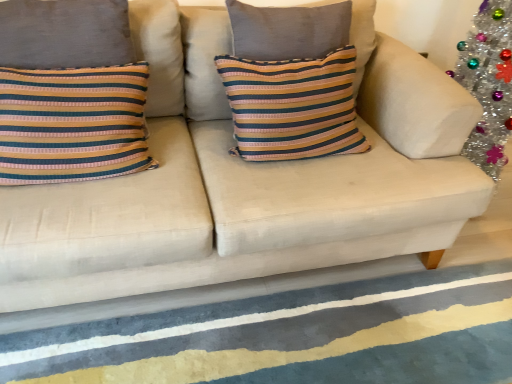
Describe the element at coordinates (294, 337) in the screenshot. I see `textured blue rug at lower center` at that location.

Locate an element on the screen. textured blue rug at lower center is located at coordinates (294, 337).

What is the approximate height of textured blue rug at lower center?

textured blue rug at lower center is 1.95 inches tall.

What is the approximate width of striped fabric pillow at center?

9.18 inches.

Describe the element at coordinates (293, 106) in the screenshot. The width and height of the screenshot is (512, 384). I see `striped fabric pillow at center` at that location.

What is the approximate height of striped fabric pillow at center?

It is 19.53 inches.

Locate an element on the screen. Image resolution: width=512 pixels, height=384 pixels. striped fabric pillow at center is located at coordinates (293, 106).

Image resolution: width=512 pixels, height=384 pixels. What are the coordinates of `textured blue rug at lower center` in the screenshot? It's located at coord(294,337).

Consider the image. Considering the relative positions of striped fabric pillow at center and textured blue rug at lower center in the image provided, is striped fabric pillow at center to the right of textured blue rug at lower center from the viewer's perspective?

No.

Does striped fabric pillow at center come behind textured blue rug at lower center?

Yes, striped fabric pillow at center is further from the viewer.

Between point (316, 146) and point (486, 297), which one is positioned in front?

The point (316, 146) is closer.

Consider the image. From the image's perspective, which one is positioned higher, striped fabric pillow at center or textured blue rug at lower center?

striped fabric pillow at center appears higher in the image.

From a real-world perspective, is striped fabric pillow at center under textured blue rug at lower center?

No, from a real-world perspective, striped fabric pillow at center is not beneath textured blue rug at lower center.

Can you confirm if striped fabric pillow at center is thinner than textured blue rug at lower center?

Indeed, striped fabric pillow at center has a lesser width compared to textured blue rug at lower center.

Does striped fabric pillow at center have a lesser height compared to textured blue rug at lower center?

No, striped fabric pillow at center is not shorter than textured blue rug at lower center.

Looking at the image, does striped fabric pillow at center seem bigger or smaller compared to textured blue rug at lower center?

In the image, striped fabric pillow at center appears to be larger than textured blue rug at lower center.

Is striped fabric pillow at center not inside textured blue rug at lower center?

striped fabric pillow at center is positioned outside textured blue rug at lower center.

Is striped fabric pillow at center beside textured blue rug at lower center?

No, striped fabric pillow at center is not with textured blue rug at lower center.

Is striped fabric pillow at center facing away from textured blue rug at lower center?

striped fabric pillow at center does not have its back to textured blue rug at lower center.

How many degrees apart are the facing directions of striped fabric pillow at center and textured blue rug at lower center?

90 degrees.

The width and height of the screenshot is (512, 384). Identify the location of stripe in front of the striped fabric pillow at center. (294, 337).

Between textured blue rug at lower center and striped fabric pillow at center, which one appears on the right side from the viewer's perspective?

Positioned to the right is textured blue rug at lower center.

Is textured blue rug at lower center positioned before striped fabric pillow at center?

Yes, it is.

Is point (504, 264) closer to camera compared to point (328, 114)?

No, it is behind (328, 114).

From the image's perspective, does textured blue rug at lower center appear higher than striped fabric pillow at center?

Incorrect, from the image's perspective, textured blue rug at lower center is lower than striped fabric pillow at center.

From a real-world perspective, which is physically above, textured blue rug at lower center or striped fabric pillow at center?

From a 3D spatial view, striped fabric pillow at center is above.

Which object is wider, textured blue rug at lower center or striped fabric pillow at center?

textured blue rug at lower center.

Considering the sizes of objects textured blue rug at lower center and striped fabric pillow at center in the image provided, who is taller, textured blue rug at lower center or striped fabric pillow at center?

striped fabric pillow at center.

Does textured blue rug at lower center have a larger size compared to striped fabric pillow at center?

No.

Consider the image. Do you think textured blue rug at lower center is within striped fabric pillow at center, or outside of it?

textured blue rug at lower center is outside striped fabric pillow at center.

Is textured blue rug at lower center in contact with striped fabric pillow at center?

No, textured blue rug at lower center is not making contact with striped fabric pillow at center.

Could you tell me if textured blue rug at lower center is facing striped fabric pillow at center?

No, textured blue rug at lower center is not facing towards striped fabric pillow at center.

How different are the orientations of textured blue rug at lower center and striped fabric pillow at center in degrees?

There is a 90-degree angle between the facing directions of textured blue rug at lower center and striped fabric pillow at center.

In the image, there is a textured blue rug at lower center. Identify the location of pillow above it (from the image's perspective). Image resolution: width=512 pixels, height=384 pixels. (293, 106).

Find the location of a particular element. Image resolution: width=512 pixels, height=384 pixels. stripe on the right of striped fabric pillow at center is located at coordinates (294, 337).

The image size is (512, 384). Find the location of `pillow above the textured blue rug at lower center (from the image's perspective)`. pillow above the textured blue rug at lower center (from the image's perspective) is located at coordinates (293, 106).